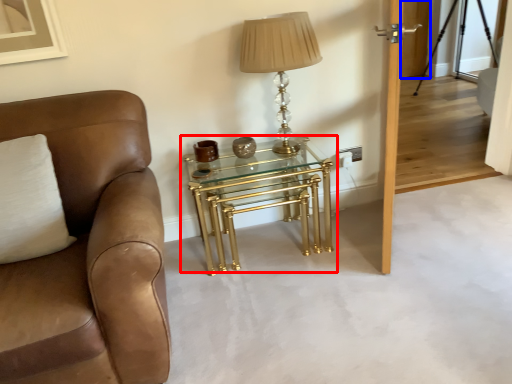
Question: Which object is further to the camera taking this photo, table (highlighted by a red box) or glass door (highlighted by a blue box)?

Choices:
 (A) table
 (B) glass door

Answer: (B)